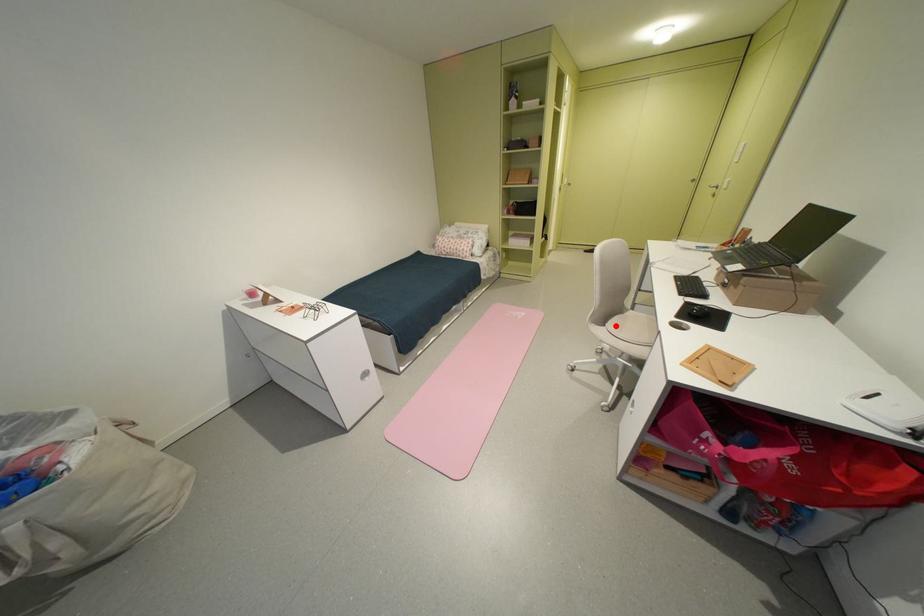
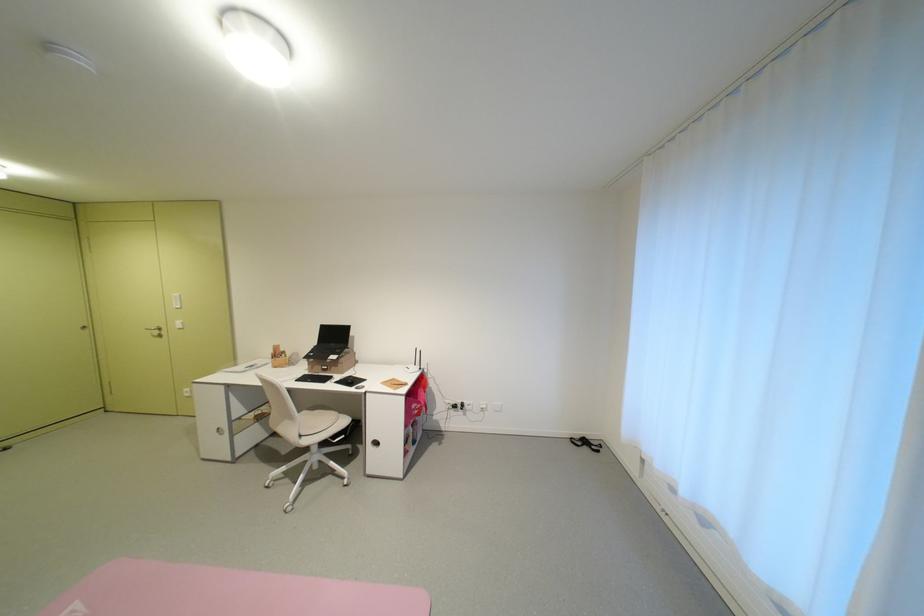
Question: I am providing you with two images of the same scene from different viewpoints. A red point is marked on the first image. Is the red point's position out of view in image 2?

Choices:
 (A) Yes
 (B) No

Answer: (B)